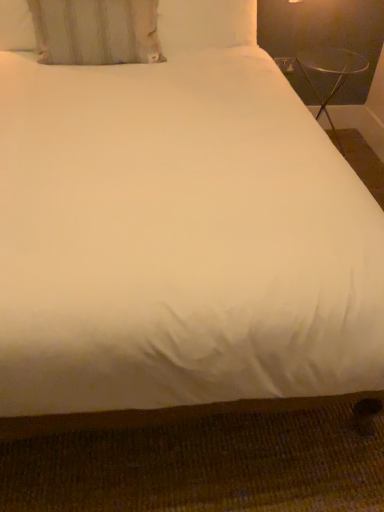
Locate an element on the screen. This screenshot has width=384, height=512. white fabric pillow at upper left is located at coordinates (96, 31).

Describe the element at coordinates (96, 31) in the screenshot. Image resolution: width=384 pixels, height=512 pixels. I see `white fabric pillow at upper left` at that location.

I want to click on transparent glass table at upper right, so click(x=331, y=73).

The image size is (384, 512). Describe the element at coordinates (331, 73) in the screenshot. I see `transparent glass table at upper right` at that location.

Where is `white fabric pillow at upper left`? The width and height of the screenshot is (384, 512). white fabric pillow at upper left is located at coordinates (96, 31).

Based on the photo, which is more to the left, transparent glass table at upper right or white fabric pillow at upper left?

Positioned to the left is white fabric pillow at upper left.

Does transparent glass table at upper right lie in front of white fabric pillow at upper left?

No.

Between point (318, 65) and point (150, 49), which one is positioned behind?

The point (318, 65) is farther from the camera.

From the image's perspective, is transparent glass table at upper right located above or below white fabric pillow at upper left?

Based on their image positions, transparent glass table at upper right is located beneath white fabric pillow at upper left.

From a real-world perspective, between transparent glass table at upper right and white fabric pillow at upper left, who is vertically higher?

In real-world perspective, white fabric pillow at upper left is above.

Considering the relative sizes of transparent glass table at upper right and white fabric pillow at upper left in the image provided, is transparent glass table at upper right wider than white fabric pillow at upper left?

Yes, transparent glass table at upper right is wider than white fabric pillow at upper left.

Between transparent glass table at upper right and white fabric pillow at upper left, which one has more height?

transparent glass table at upper right.

Is transparent glass table at upper right bigger or smaller than white fabric pillow at upper left?

Clearly, transparent glass table at upper right is larger in size than white fabric pillow at upper left.

Consider the image. Would you say transparent glass table at upper right is inside or outside white fabric pillow at upper left?

transparent glass table at upper right is spatially situated outside white fabric pillow at upper left.

Is transparent glass table at upper right next to white fabric pillow at upper left?

No, transparent glass table at upper right is not beside white fabric pillow at upper left.

Is transparent glass table at upper right facing towards white fabric pillow at upper left?

No, transparent glass table at upper right is not aimed at white fabric pillow at upper left.

Can you tell me how much transparent glass table at upper right and white fabric pillow at upper left differ in facing direction?

The angular difference between transparent glass table at upper right and white fabric pillow at upper left is 6.47 degrees.

How much distance is there between transparent glass table at upper right and white fabric pillow at upper left?

transparent glass table at upper right and white fabric pillow at upper left are 4.21 feet apart.

You are a GUI agent. You are given a task and a screenshot of the screen. Output one action in this format:
    pyautogui.click(x=<x>, y=<y>)
    Task: Click on the pillow above the transparent glass table at upper right (from a real-world perspective)
    The width and height of the screenshot is (384, 512).
    Given the screenshot: What is the action you would take?
    pyautogui.click(x=96, y=31)

Between white fabric pillow at upper left and transparent glass table at upper right, which one appears on the left side from the viewer's perspective?

Positioned to the left is white fabric pillow at upper left.

Does white fabric pillow at upper left come behind transparent glass table at upper right?

No, white fabric pillow at upper left is closer to the viewer.

Between point (28, 0) and point (326, 55), which one is positioned in front?

The point (28, 0) is closer to the camera.

From the image's perspective, is white fabric pillow at upper left positioned above or below transparent glass table at upper right?

Clearly, from the image's perspective, white fabric pillow at upper left is above transparent glass table at upper right.

From a real-world perspective, is white fabric pillow at upper left on top of transparent glass table at upper right?

Yes, from a real-world perspective, white fabric pillow at upper left is over transparent glass table at upper right

Is white fabric pillow at upper left wider or thinner than transparent glass table at upper right?

Clearly, white fabric pillow at upper left has less width compared to transparent glass table at upper right.

Is white fabric pillow at upper left taller or shorter than transparent glass table at upper right?

Considering their sizes, white fabric pillow at upper left has less height than transparent glass table at upper right.

Considering the sizes of objects white fabric pillow at upper left and transparent glass table at upper right in the image provided, who is smaller, white fabric pillow at upper left or transparent glass table at upper right?

white fabric pillow at upper left is smaller.

Is white fabric pillow at upper left spatially inside transparent glass table at upper right, or outside of it?

→ white fabric pillow at upper left is spatially situated outside transparent glass table at upper right.

Consider the image. Can you see white fabric pillow at upper left touching transparent glass table at upper right?

No, white fabric pillow at upper left is not with transparent glass table at upper right.

Could you tell me if white fabric pillow at upper left is facing transparent glass table at upper right?

No, white fabric pillow at upper left is not turned towards transparent glass table at upper right.

How many degrees apart are the facing directions of white fabric pillow at upper left and transparent glass table at upper right?

6.47 degrees separate the facing orientations of white fabric pillow at upper left and transparent glass table at upper right.

Image resolution: width=384 pixels, height=512 pixels. Find the location of `pillow lying above the transparent glass table at upper right (from the image's perspective)`. pillow lying above the transparent glass table at upper right (from the image's perspective) is located at coordinates (96, 31).

The image size is (384, 512). In order to click on table that appears behind the white fabric pillow at upper left in this screenshot , I will do `click(331, 73)`.

Find the location of a particular element. This screenshot has width=384, height=512. table that appears below the white fabric pillow at upper left (from the image's perspective) is located at coordinates (331, 73).